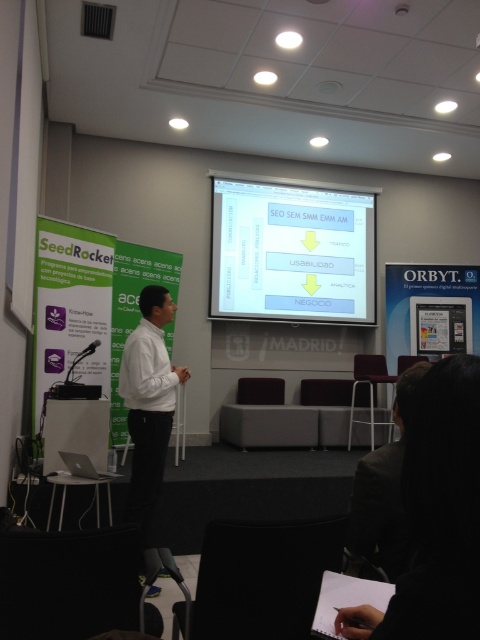
You are an event organizer preparing for a photoshoot in the conference room. You need to ensure that the white matte shirt at center and the dark gray suit at lower right are visible in the frame. Considering their sizes, which object should you focus on to ensure both are in the shot without cropping?

The white matte shirt at center is wider than the dark gray suit at lower right. To ensure both are in the frame without cropping, focus on including the wider white matte shirt at center first, as it requires more space, and the narrower dark gray suit at lower right will naturally fit within the same frame.

You are an attendee sitting in the front row of the conference room. You notice two points on the projection screen during the presentation. The first point is labeled as point 1 at coordinates (251, 195) and the second point is labeled as point 2 at coordinates (148, 369). Which point is closer to you?

Point 1 at coordinates (251, 195) is closer to you because it is further to the viewer than point 2 at coordinates (148, 369).

You are an attendee sitting in the conference room and want to take a photo of the presentation. The white glossy projector screen at upper center and the white matte shirt at center are both in your camera frame. Which object will appear taller in the photo?

The white glossy projector screen at upper center will appear taller in the photo because it has a greater height compared to the white matte shirt at center.